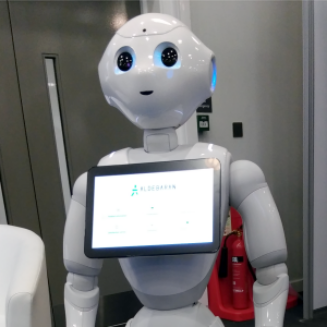
Where is `tablet bezel`? Image resolution: width=327 pixels, height=327 pixels. tablet bezel is located at coordinates (176, 166), (154, 249), (89, 213), (216, 207).